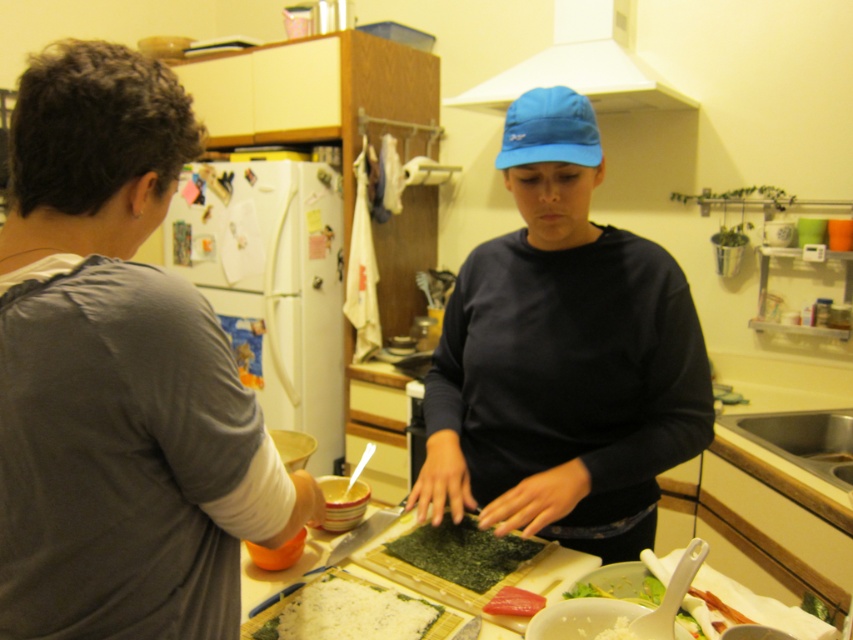
In the kitchen scene, there are two people preparing food. The person on the left is wearing a gray shirt and the person on the right is wearing a dark long sleeve shirt and a blue cap. There is also a point labeled as point (582, 65). Based on the coordinates, where is this point located in relation to the two people?

The point (582, 65) is located on the white matte exhaust hood at upper center, which is above and behind both individuals in the scene.

You are a food safety inspector in the kitchen. You need to check the height of the gray cotton shirt at left and the green matte seaweed at center to ensure they comply with health regulations. Which object is taller?

The gray cotton shirt at left is taller than the green matte seaweed at center according to the description.

You are a food delivery person who needs to deliver a meal to the kitchen. The instructions say to place the delivery next to the gray cotton shirt at left without blocking the white creamy salad at lower right. Can you do this based on their positions?

The gray cotton shirt at left is to the left of the white creamy salad at lower right, so placing the delivery next to the gray cotton shirt at left would not block the white creamy salad at lower right since it is positioned to the left side of it.